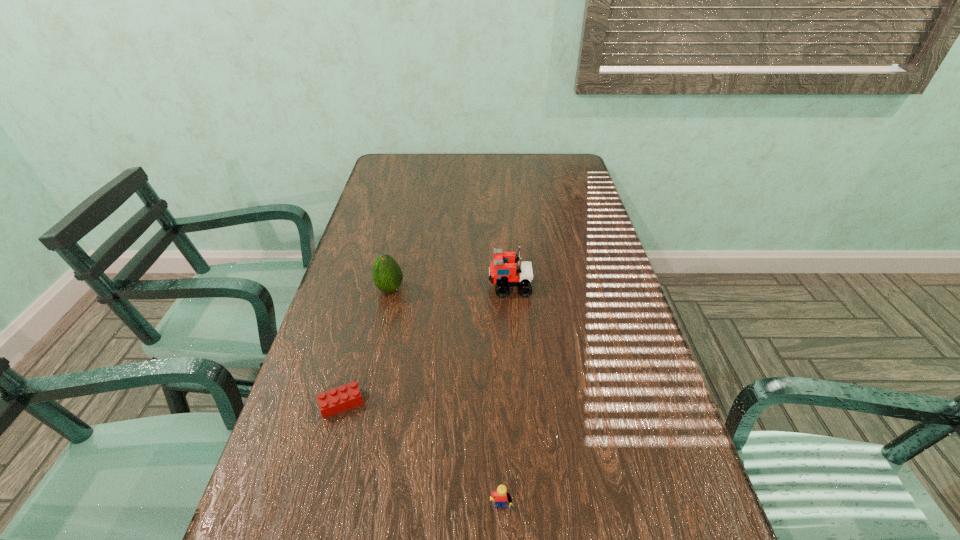
Identify the location of avocado. (387, 275).

At what (x,y) coordinates should I click in order to perform the action: click on the farthest Lego. Please return your answer as a coordinate pair (x, y). This screenshot has height=540, width=960. Looking at the image, I should click on (503, 271).

I want to click on the nearest Lego, so click(x=502, y=497).

This screenshot has height=540, width=960. What are the coordinates of `the nearest object` in the screenshot? It's located at (502, 497).

The width and height of the screenshot is (960, 540). What are the coordinates of `the second nearest object` in the screenshot? It's located at (334, 401).

This screenshot has height=540, width=960. I want to click on the second nearest Lego, so click(x=334, y=401).

Identify the location of free space located 0.400m on the front of the avocado. This screenshot has width=960, height=540. (356, 441).

The width and height of the screenshot is (960, 540). I want to click on free region located 0.170m on the front-facing side of the tallest Lego, so click(427, 286).

The image size is (960, 540). What are the coordinates of `blank space located 0.180m on the front-facing side of the tallest Lego` in the screenshot? It's located at (423, 286).

At what (x,y) coordinates should I click in order to perform the action: click on vacant space situated 0.380m on the front-facing side of the tallest Lego. Please return your answer as a coordinate pair (x, y). Looking at the image, I should click on (350, 286).